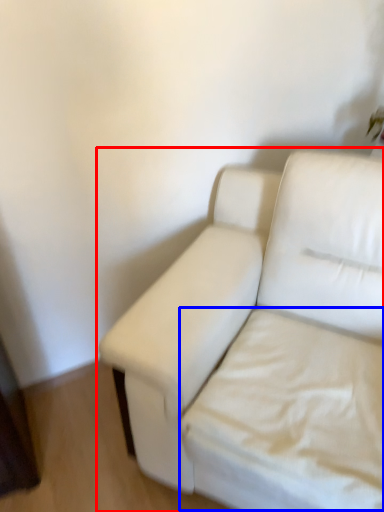
Question: Which point is further to the camera, studio couch (highlighted by a red box) or sheet (highlighted by a blue box)?

Choices:
 (A) studio couch
 (B) sheet

Answer: (B)